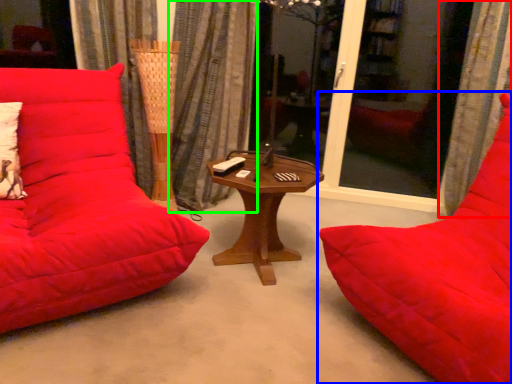
Question: Based on their relative distances, which object is nearer to curtain (highlighted by a red box)? Choose from studio couch (highlighted by a blue box) and curtain (highlighted by a green box).

Choices:
 (A) studio couch
 (B) curtain

Answer: (A)